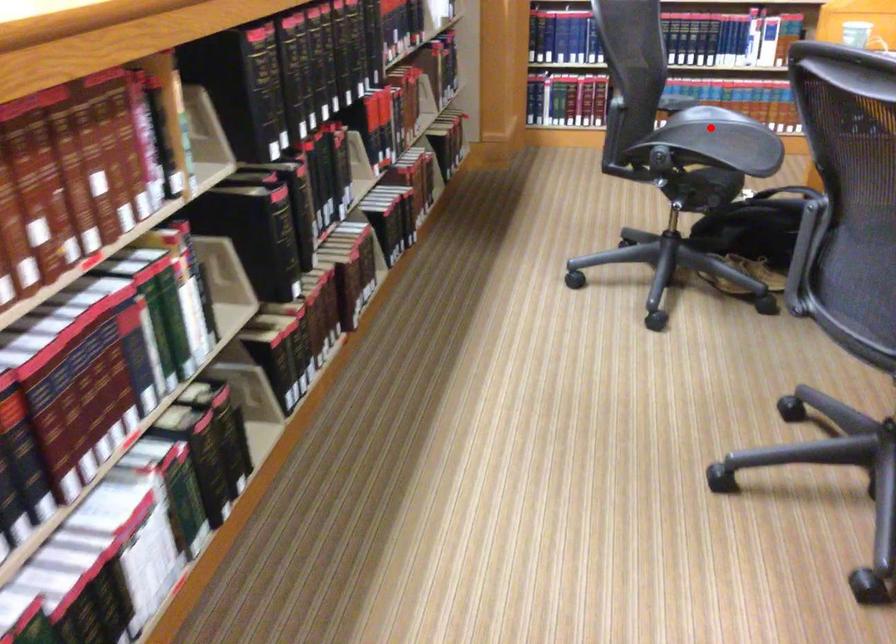
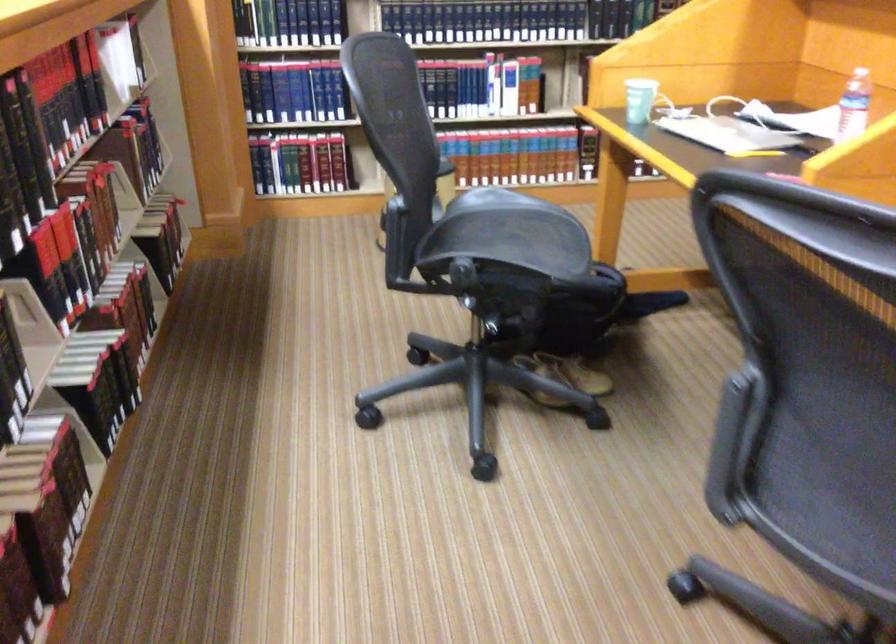
Locate, in the second image, the point that corresponds to the highlighted location in the first image.

(500, 221)